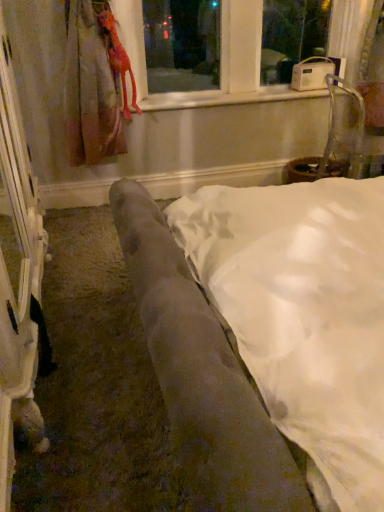
Question: Does rubber duck at upper left appear on the left side of white plastic radio at upper center?

Choices:
 (A) yes
 (B) no

Answer: (A)

Question: Is rubber duck at upper left in front of white plastic radio at upper center?

Choices:
 (A) yes
 (B) no

Answer: (A)

Question: From the image's perspective, would you say rubber duck at upper left is shown under white plastic radio at upper center?

Choices:
 (A) no
 (B) yes

Answer: (B)

Question: Is rubber duck at upper left bigger than white plastic radio at upper center?

Choices:
 (A) yes
 (B) no

Answer: (B)

Question: Can you confirm if rubber duck at upper left is positioned to the right of white plastic radio at upper center?

Choices:
 (A) yes
 (B) no

Answer: (B)

Question: Do you think white plastic radio at upper center is within rubber duck at upper left, or outside of it?

Choices:
 (A) inside
 (B) outside

Answer: (B)

Question: Is white plastic radio at upper center to the left or to the right of rubber duck at upper left in the image?

Choices:
 (A) left
 (B) right

Answer: (B)

Question: In terms of width, does white plastic radio at upper center look wider or thinner when compared to rubber duck at upper left?

Choices:
 (A) thin
 (B) wide

Answer: (B)

Question: From the image's perspective, is white plastic radio at upper center above or below rubber duck at upper left?

Choices:
 (A) above
 (B) below

Answer: (A)

Question: From a real-world perspective, relative to velvet gray couch at center, is rubber duck at upper left vertically above or below?

Choices:
 (A) below
 (B) above

Answer: (B)

Question: Is rubber duck at upper left wider or thinner than velvet gray couch at center?

Choices:
 (A) thin
 (B) wide

Answer: (A)

Question: Is rubber duck at upper left taller or shorter than velvet gray couch at center?

Choices:
 (A) tall
 (B) short

Answer: (A)

Question: Is rubber duck at upper left inside or outside of velvet gray couch at center?

Choices:
 (A) inside
 (B) outside

Answer: (B)

Question: From a real-world perspective, is velvet gray couch at center physically located above or below rubber duck at upper left?

Choices:
 (A) above
 (B) below

Answer: (B)

Question: Is point (253, 399) closer or farther from the camera than point (119, 44)?

Choices:
 (A) farther
 (B) closer

Answer: (B)